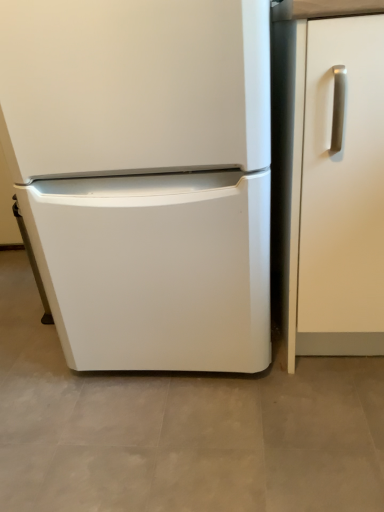
Locate an element on the screen. free space in front of white matte refrigerator at center is located at coordinates (190, 438).